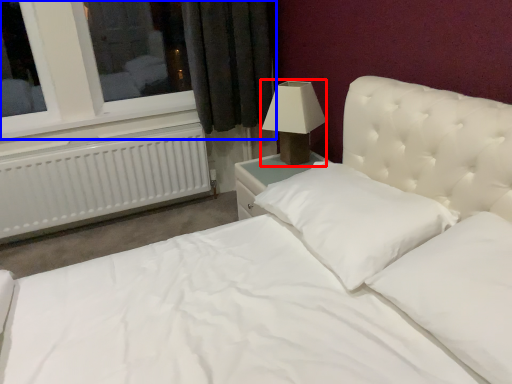
Question: Which point is further to the camera, lamp (highlighted by a red box) or window (highlighted by a blue box)?

Choices:
 (A) lamp
 (B) window

Answer: (B)